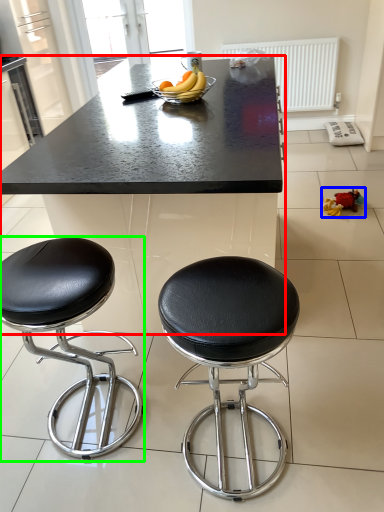
Question: Considering the real-world distances, which object is closest to table (highlighted by a red box)? toy (highlighted by a blue box) or stool (highlighted by a green box).

Choices:
 (A) toy
 (B) stool

Answer: (B)